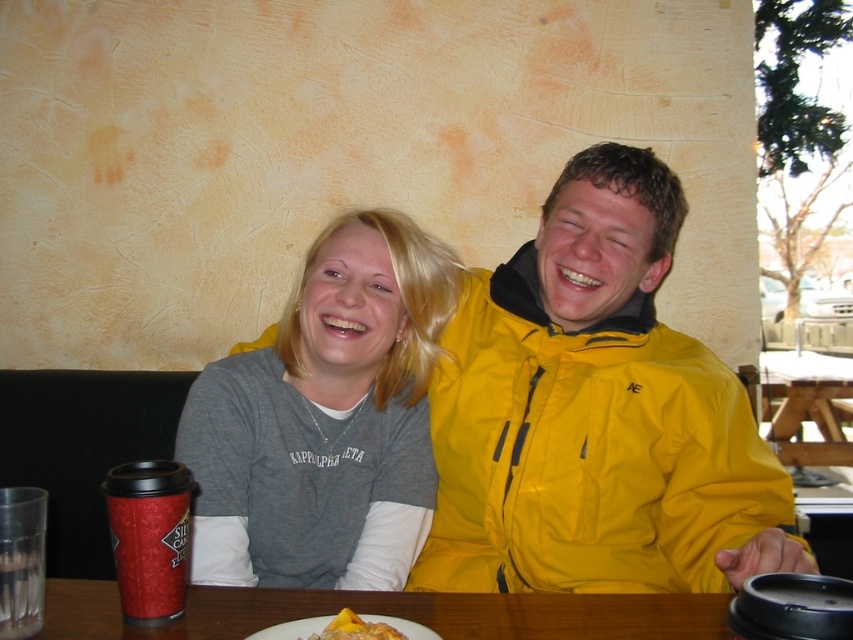
Question: Estimate the real-world distances between objects in this image. Which object is farther from the yellow matte cake at lower center?

Choices:
 (A) brown wooden table at center
 (B) gray cotton t-shirt at center
 (C) yellow waterproof jacket at right

Answer: (C)

Question: Which object appears farthest from the camera in this image?

Choices:
 (A) gray cotton t-shirt at center
 (B) yellow waterproof jacket at right
 (C) yellow matte cake at lower center
 (D) brown wooden table at center

Answer: (B)

Question: Is yellow waterproof jacket at right behind yellow matte cake at lower center?

Choices:
 (A) no
 (B) yes

Answer: (B)

Question: Does gray cotton t-shirt at center come in front of brown wooden table at center?

Choices:
 (A) no
 (B) yes

Answer: (A)

Question: Where is yellow waterproof jacket at right located in relation to brown wooden table at center in the image?

Choices:
 (A) left
 (B) right

Answer: (B)

Question: Which of these objects is positioned closest to the brown wooden table at center?

Choices:
 (A) yellow waterproof jacket at right
 (B) gray cotton t-shirt at center

Answer: (B)